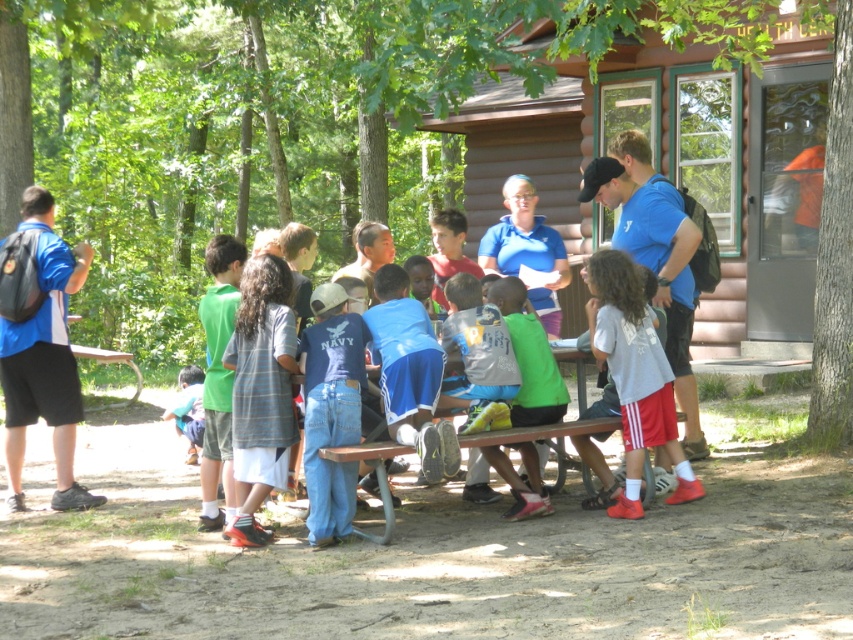
You are a photographer standing at the edge of the campsite and want to capture a photo of the denim jeans at center and the blue fabric shorts at center. Which object should you focus on first to ensure both are in sharp focus?

You should focus on the denim jeans at center first because it is closer to you than the blue fabric shorts at center, ensuring both will be in focus when focused on the closer object.

You are a photographer trying to capture a photo of the denim jeans at center and the green fabric shirt at lower left. Which object should you focus on first if you want to ensure both are in focus without moving the camera?

The denim jeans at center is located above the green fabric shirt at lower left, so you should focus on the denim jeans at center first to ensure both are in focus since it is closer to the camera.

You are a photographer at the campsite and want to capture a photo of the striped cotton shirt at center and the green fabric shirt at lower left. Which shirt should you focus on first if you want to include both in the frame without moving the camera?

You should focus on the green fabric shirt at lower left first because it is positioned to the left of the striped cotton shirt at center, allowing both to be captured in the frame without needing to adjust the camera angle.